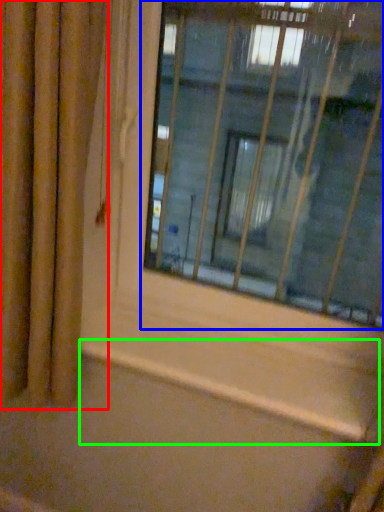
Question: Estimate the real-world distances between objects in this image. Which object is farther from curtain (highlighted by a red box), window (highlighted by a blue box) or window sill (highlighted by a green box)?

Choices:
 (A) window
 (B) window sill

Answer: (A)